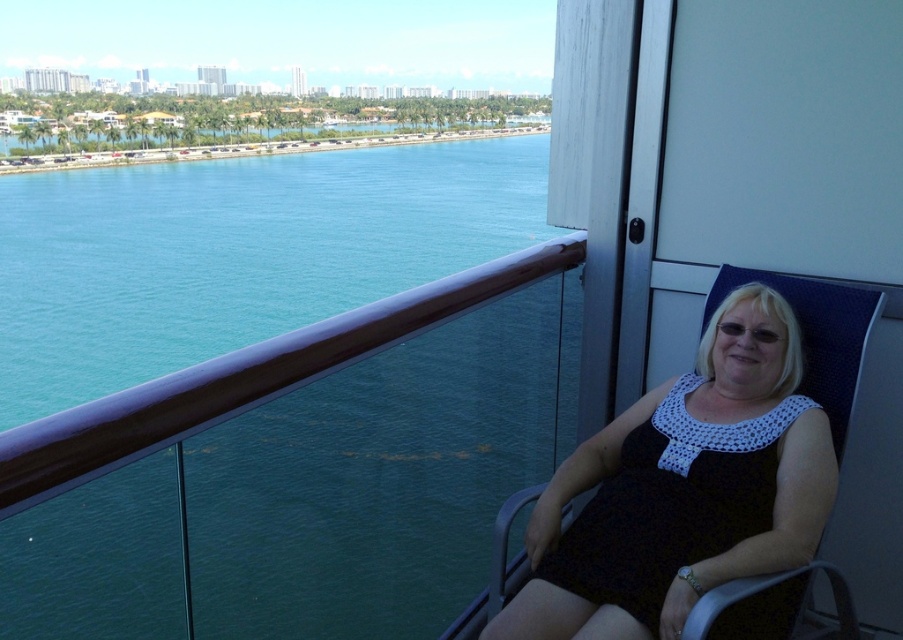
Who is lower down, teal glossy water at upper left or black crochet dress at right?

black crochet dress at right is lower down.

Locate an element on the screen. teal glossy water at upper left is located at coordinates (380, 476).

Between point (224, 300) and point (797, 560), which one is positioned behind?

The point (224, 300) is behind.

Locate an element on the screen. The image size is (903, 640). teal glossy water at upper left is located at coordinates (380, 476).